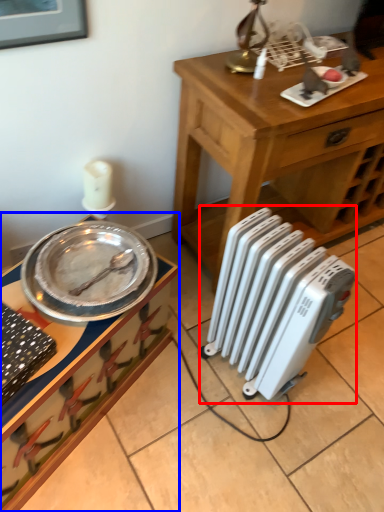
Question: Among these objects, which one is nearest to the camera, radiator (highlighted by a red box) or desk (highlighted by a blue box)?

Choices:
 (A) radiator
 (B) desk

Answer: (B)